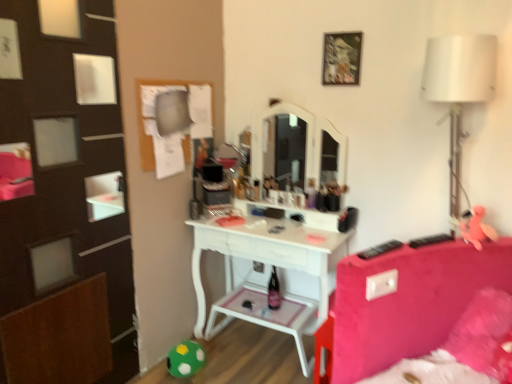
Question: Does green felt ball at lower left, the 2th toy in the top-to-bottom sequence, have a lesser width compared to pink rubber duck at right, arranged as the first toy when viewed from the top?

Choices:
 (A) yes
 (B) no

Answer: (B)

Question: Is green felt ball at lower left, which appears as the first toy when viewed from the left, positioned in front of pink rubber duck at right, the 1th toy when ordered from front to back?

Choices:
 (A) yes
 (B) no

Answer: (B)

Question: From the image's perspective, is green felt ball at lower left, the 2th toy in the top-to-bottom sequence, on top of pink rubber duck at right, which is the second toy in back-to-front order?

Choices:
 (A) no
 (B) yes

Answer: (A)

Question: From the image's perspective, would you say green felt ball at lower left, which is counted as the second toy, starting from the right, is shown under pink rubber duck at right, acting as the 1th toy starting from the right?

Choices:
 (A) no
 (B) yes

Answer: (B)

Question: Is green felt ball at lower left, placed as the 1th toy when sorted from bottom to top, bigger than pink rubber duck at right, which is counted as the 2th toy, starting from the bottom?

Choices:
 (A) no
 (B) yes

Answer: (B)

Question: Does point (474, 213) appear closer or farther from the camera than point (173, 364)?

Choices:
 (A) farther
 (B) closer

Answer: (B)

Question: Considering the relative positions of pink rubber duck at right, which is the second toy in back-to-front order, and green felt ball at lower left, which is counted as the second toy, starting from the right, in the image provided, is pink rubber duck at right, which is the second toy in back-to-front order, to the left or to the right of green felt ball at lower left, which is counted as the second toy, starting from the right,?

Choices:
 (A) right
 (B) left

Answer: (A)

Question: In terms of width, does pink rubber duck at right, which is counted as the 2th toy, starting from the bottom, look wider or thinner when compared to green felt ball at lower left, which appears as the first toy when viewed from the left?

Choices:
 (A) thin
 (B) wide

Answer: (A)

Question: Do you think pink rubber duck at right, arranged as the first toy when viewed from the top, is within green felt ball at lower left, the 2th toy in the top-to-bottom sequence, or outside of it?

Choices:
 (A) outside
 (B) inside

Answer: (A)

Question: Considering the positions of white fabric lampshade at right and pink rubber duck at right, acting as the 1th toy starting from the right, in the image, is white fabric lampshade at right taller or shorter than pink rubber duck at right, acting as the 1th toy starting from the right,?

Choices:
 (A) short
 (B) tall

Answer: (B)

Question: In the image, is white fabric lampshade at right on the left side or the right side of pink rubber duck at right, arranged as the first toy when viewed from the top?

Choices:
 (A) right
 (B) left

Answer: (B)

Question: From the image's perspective, is white fabric lampshade at right positioned above or below pink rubber duck at right, which is the second toy in back-to-front order?

Choices:
 (A) above
 (B) below

Answer: (A)

Question: From a real-world perspective, relative to pink rubber duck at right, arranged as the first toy when viewed from the top, is white fabric lampshade at right vertically above or below?

Choices:
 (A) below
 (B) above

Answer: (B)

Question: Considering the positions of point (474, 230) and point (330, 57), is point (474, 230) closer or farther from the camera than point (330, 57)?

Choices:
 (A) farther
 (B) closer

Answer: (B)

Question: From a real-world perspective, is pink rubber duck at right, which appears as the 2th toy when viewed from the left, positioned above or below wooden picture frame at upper center?

Choices:
 (A) below
 (B) above

Answer: (A)